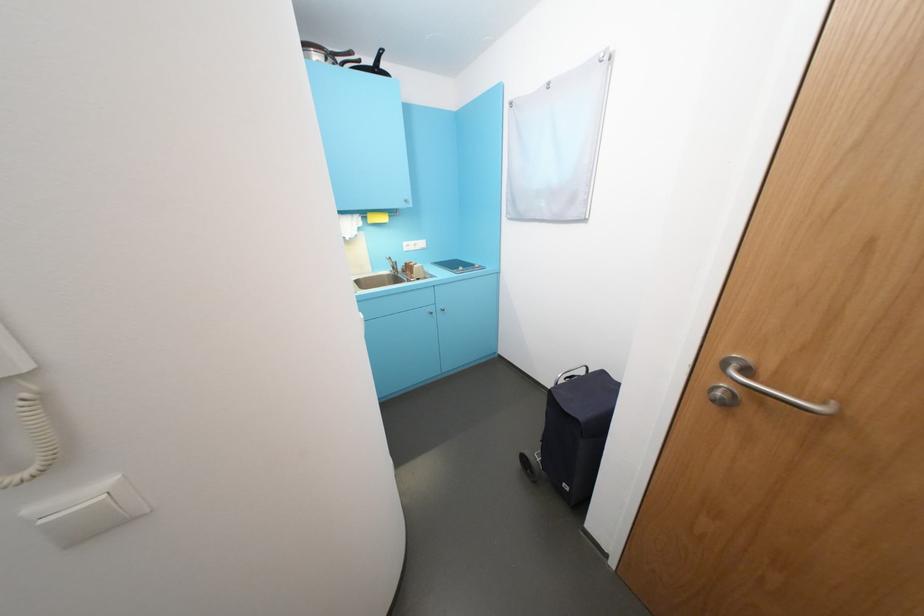
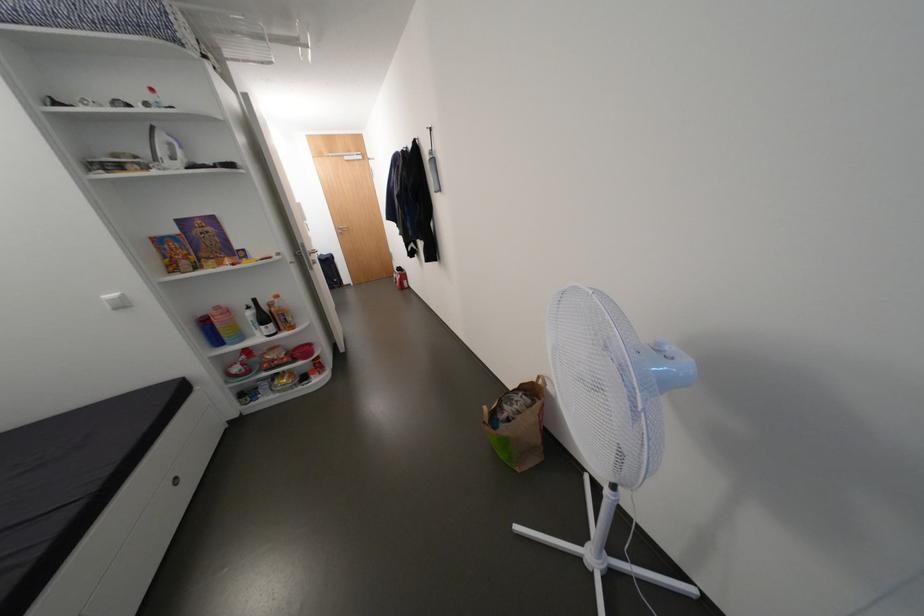
Where in the second image is the point corresponding to pixel 726 394 from the first image?

(348, 233)